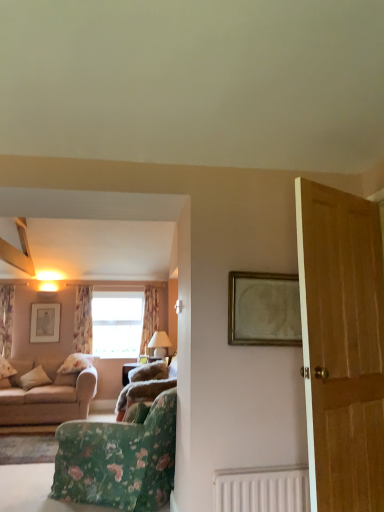
Question: From the image's perspective, relative to floral fabric curtain at left, the second curtain when ordered from left to right, is matte white lampshade at center above or below?

Choices:
 (A) below
 (B) above

Answer: (A)

Question: In terms of width, does matte white lampshade at center look wider or thinner when compared to floral fabric curtain at left, positioned as the 2th curtain in right-to-left order?

Choices:
 (A) wide
 (B) thin

Answer: (A)

Question: Which object is the closest to the beige fabric couch at left, which is the 1th studio couch in left-to-right order?

Choices:
 (A) gold-toned wooden frame at upper center, arranged as the 1th picture frame when viewed from the front
 (B) matte white lampshade at center
 (C) floral fabric curtain at center, the 3th curtain viewed from the left
 (D) matte silver picture frame at upper left, which is the 2th picture frame in top-to-bottom order
 (E) floral fabric curtain at left, the second curtain when ordered from left to right

Answer: (D)

Question: Which of these objects is positioned farthest from the floral fabric curtain at left, the first curtain viewed from the left?

Choices:
 (A) floral fabric curtain at left, positioned as the 2th curtain in right-to-left order
 (B) matte silver picture frame at upper left, arranged as the 2th picture frame when viewed from the front
 (C) beige fabric couch at left, which is the 1th studio couch in left-to-right order
 (D) light brown wooden door at right
 (E) floral fabric chair at lower left

Answer: (D)